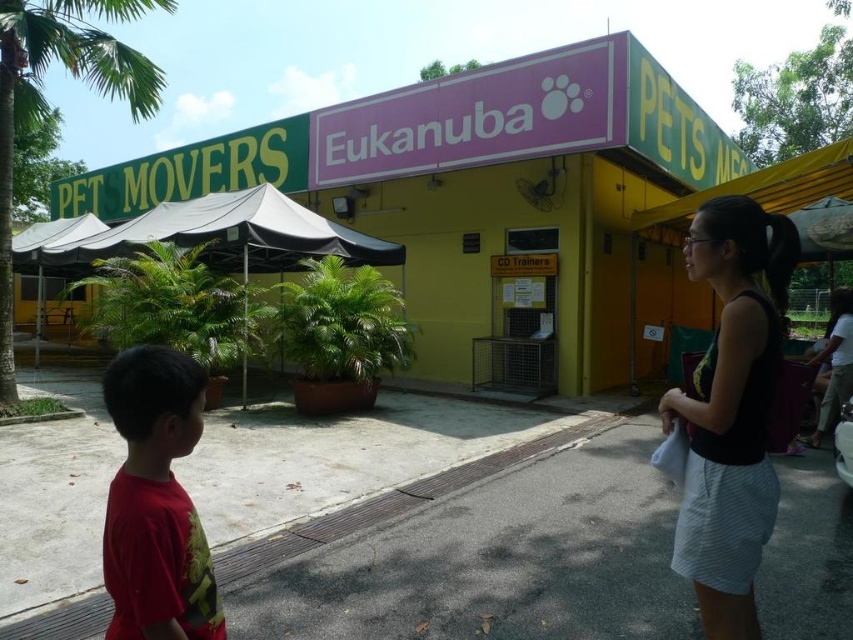
Which of these two, black fabric top at center or green leafy palm tree at upper left, stands taller?

green leafy palm tree at upper left is taller.

Is point (734, 545) behind point (39, 33)?

No, (734, 545) is closer to viewer.

The height and width of the screenshot is (640, 853). I want to click on black fabric top at center, so click(730, 410).

The image size is (853, 640). I want to click on black fabric top at center, so click(730, 410).

Is pink matte sign at center taller than green leafy palm tree at upper left?

No.

Can you confirm if pink matte sign at center is positioned below green leafy palm tree at upper left?

Yes, pink matte sign at center is below green leafy palm tree at upper left.

Is point (492, 228) positioned behind point (9, 365)?

Yes, point (492, 228) is behind point (9, 365).

Where is `pink matte sign at center`? This screenshot has width=853, height=640. pink matte sign at center is located at coordinates (471, 182).

Between red matte shirt at lower left and green leafy palm tree at upper left, which one has more height?

green leafy palm tree at upper left

Is point (136, 397) more distant than point (84, 42)?

That is False.

This screenshot has width=853, height=640. I want to click on red matte shirt at lower left, so click(x=155, y=502).